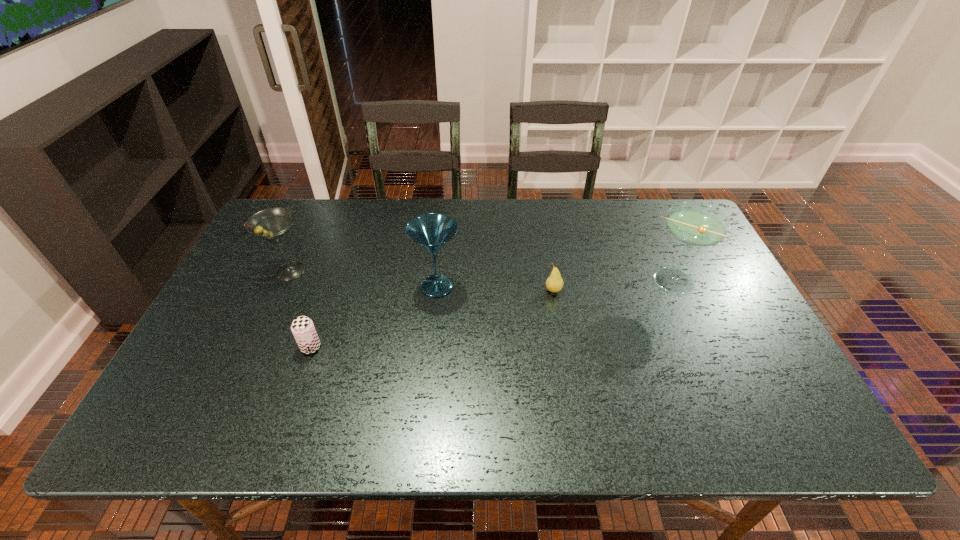
Locate an element on the screen. Image resolution: width=960 pixels, height=540 pixels. unoccupied area between the beer can and the leftmost object is located at coordinates (300, 309).

At what (x,y) coordinates should I click in order to perform the action: click on free spot between the third object from right to left and the beer can. Please return your answer as a coordinate pair (x, y). Looking at the image, I should click on (373, 317).

This screenshot has height=540, width=960. What are the coordinates of `vacant area between the fourth object from left to right and the third object from left to right` in the screenshot? It's located at (495, 288).

Where is `vacant area between the third object from left to right and the fourth object from left to right`? The width and height of the screenshot is (960, 540). vacant area between the third object from left to right and the fourth object from left to right is located at coordinates (495, 288).

Where is `vacant region between the second martini from left to right and the fourth object from left to right`? This screenshot has height=540, width=960. vacant region between the second martini from left to right and the fourth object from left to right is located at coordinates pyautogui.click(x=495, y=288).

Where is `empty location between the leftmost martini and the rightmost object`? empty location between the leftmost martini and the rightmost object is located at coordinates pyautogui.click(x=480, y=276).

You are a GUI agent. You are given a task and a screenshot of the screen. Output one action in this format:
    pyautogui.click(x=<x>, y=<y>)
    Task: Click on the free space that is in between the nearest object and the leftmost martini
    The height and width of the screenshot is (540, 960).
    Given the screenshot: What is the action you would take?
    pyautogui.click(x=300, y=309)

The image size is (960, 540). I want to click on object that is the second closest to the third object from right to left, so click(302, 327).

You are a GUI agent. You are given a task and a screenshot of the screen. Output one action in this format:
    pyautogui.click(x=<x>, y=<y>)
    Task: Click on the object that stands as the third closest to the rightmost martini
    
    Given the screenshot: What is the action you would take?
    pyautogui.click(x=302, y=327)

Where is `martini that can be found as the second closest to the leftmost object`? martini that can be found as the second closest to the leftmost object is located at coordinates (695, 224).